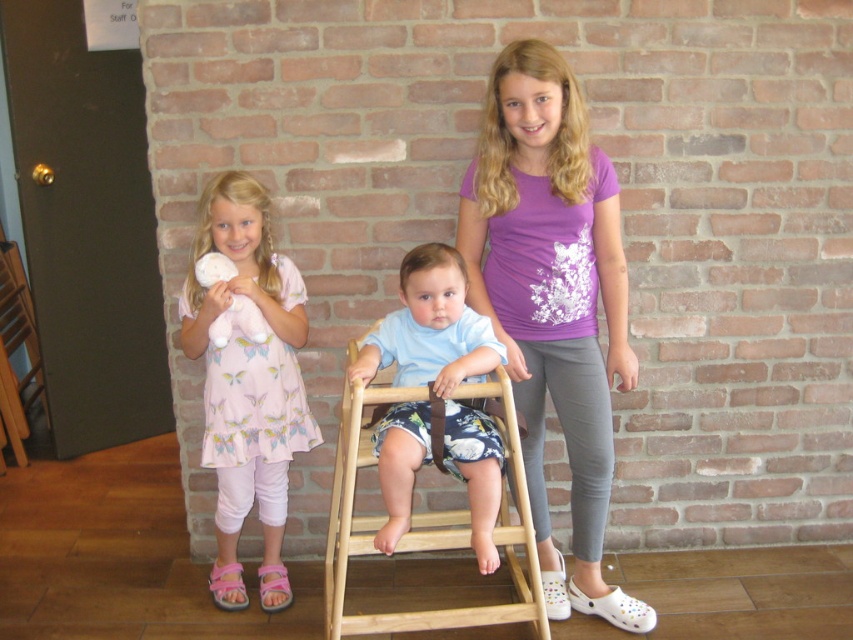
Question: Does wooden highchair at center have a lesser width compared to white plush toy at left?

Choices:
 (A) yes
 (B) no

Answer: (B)

Question: From the image, what is the correct spatial relationship of wooden highchair at center in relation to white plush toy at left?

Choices:
 (A) above
 (B) below

Answer: (B)

Question: Estimate the real-world distances between objects in this image. Which object is closer to the white plush toy at left?

Choices:
 (A) purple cotton shirt at center
 (B) pink fabric dress at left
 (C) blue cotton shirt at center
 (D) wooden highchair at center

Answer: (B)

Question: Can you confirm if purple cotton shirt at center is bigger than wooden highchair at center?

Choices:
 (A) no
 (B) yes

Answer: (A)

Question: Which point appears closest to the camera in this image?

Choices:
 (A) (274, 476)
 (B) (224, 330)

Answer: (B)

Question: Based on their relative distances, which object is farther from the pink fabric dress at left?

Choices:
 (A) purple cotton shirt at center
 (B) wooden highchair at center
 (C) blue cotton shirt at center

Answer: (A)